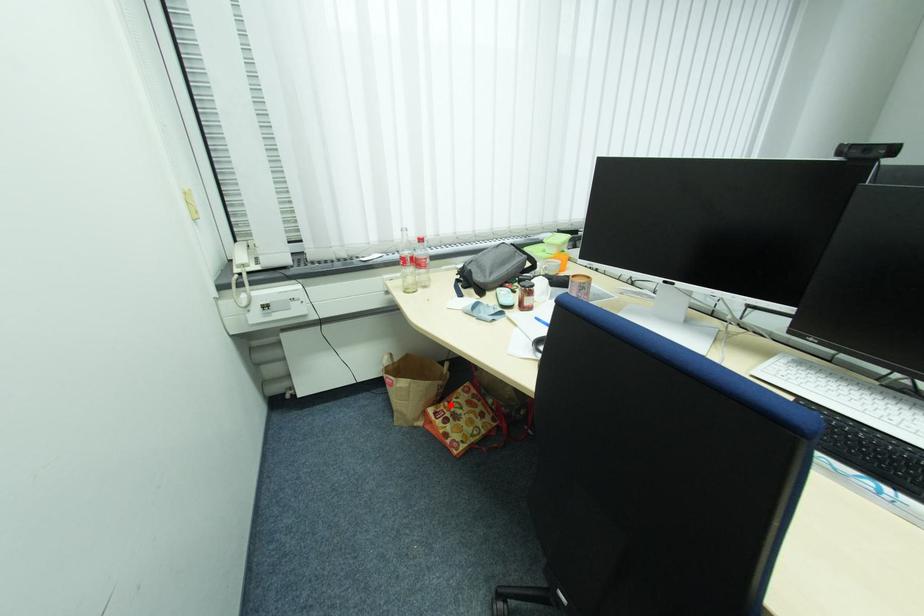
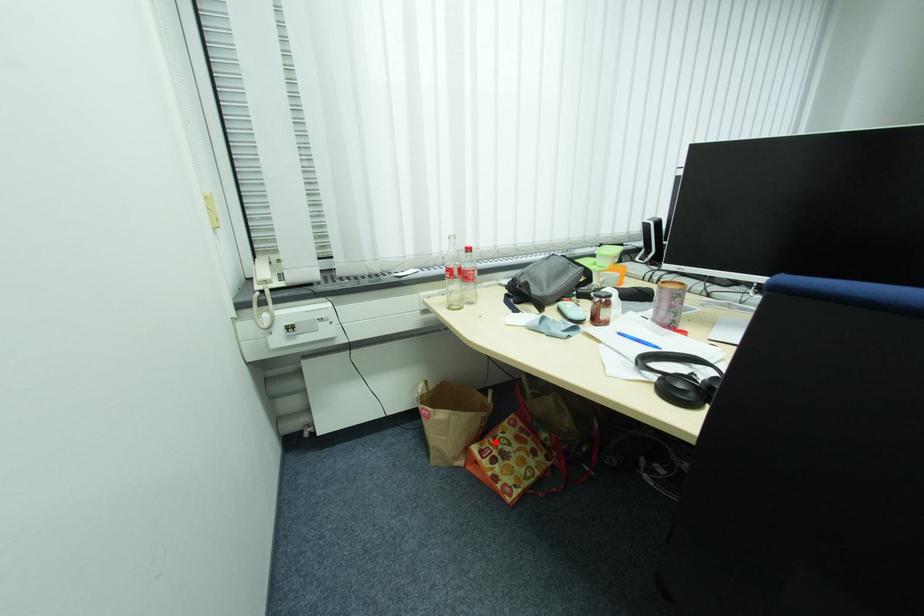
In the scene shown: I am providing you with two images of the same scene from different viewpoints. A red point is marked on the first image and another point is marked on the second image. Are the points marked in image1 and image2 representing the same 3D position?

Yes